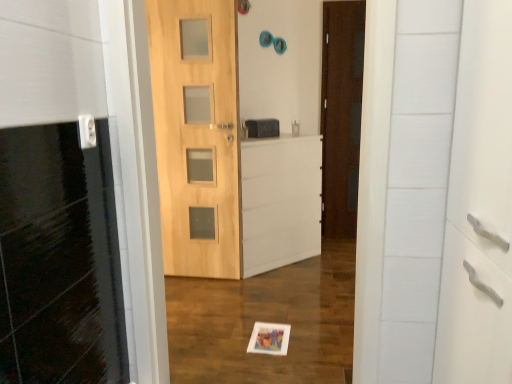
You are a GUI agent. You are given a task and a screenshot of the screen. Output one action in this format:
    pyautogui.click(x=<x>, y=<y>)
    Task: Click on the vacant space in front of white matte file cabinet at center
    The width and height of the screenshot is (512, 384).
    Given the screenshot: What is the action you would take?
    pyautogui.click(x=265, y=290)